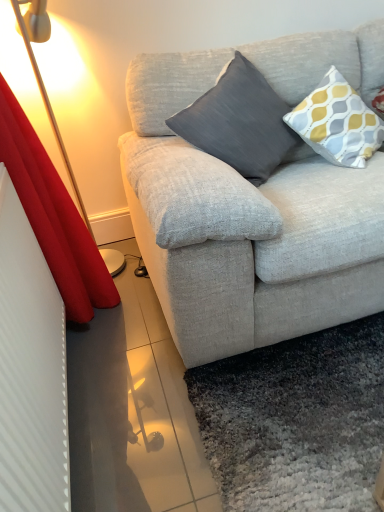
I want to click on vacant region below red velvet curtain at left (from a real-world perspective), so click(x=115, y=262).